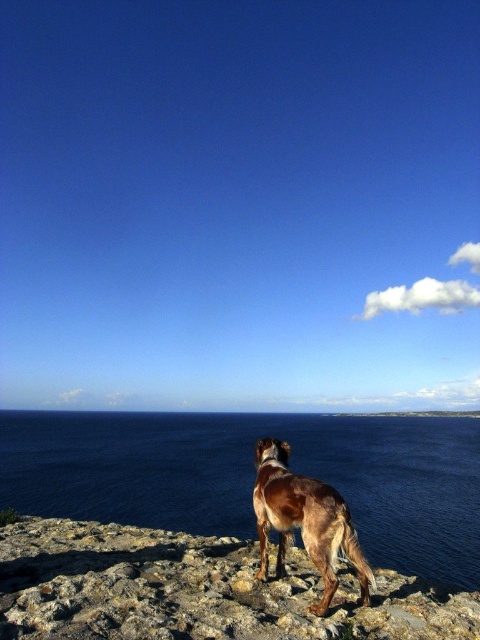
You are a photographer trying to capture the blue water at lower center and the brown speckled fur dog at center in a single frame. Based on their sizes, which object should you focus on first to ensure both are in sharp focus?

The blue water at lower center is larger than the brown speckled fur dog at center, so you should focus on the blue water at lower center first to ensure both are in sharp focus.

You are a photographer trying to capture a shot of the brown speckled fur dog at center and the blue water at lower center. From your current position, which object is closer to you?

The blue water at lower center is closer to you because the brown speckled fur dog at center is behind it.

You are a photographer standing on the rocky shoreline and want to capture a photo of the brown speckled fur dog at center and the blue water at lower center. Based on their heights, which one should you focus on first if you want to ensure both are in focus?

Answer: The blue water at lower center has a greater height compared to the brown speckled fur dog at center. Since the blue water is taller, you should focus on it first to ensure both are in focus.